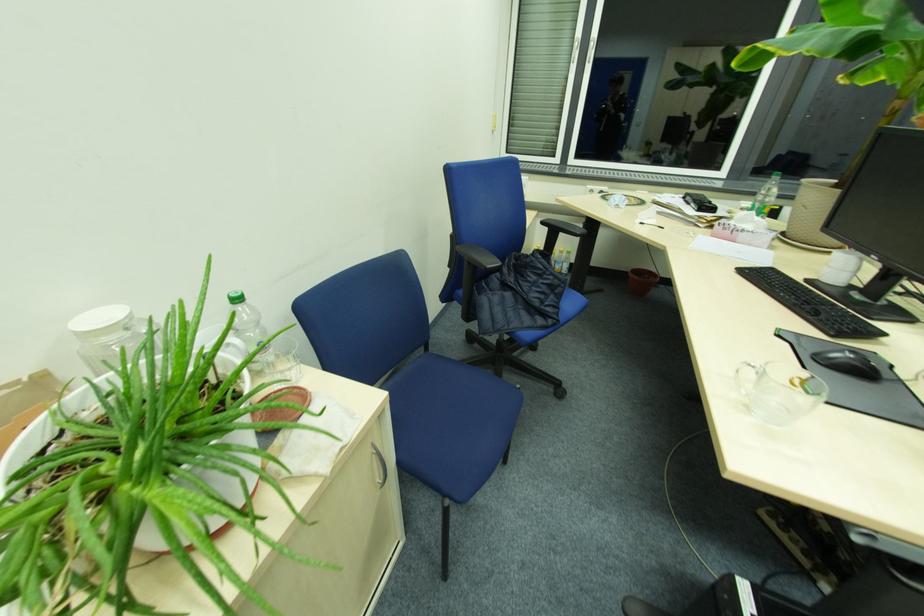
The image size is (924, 616). Find the location of `clear glass mug handle`. clear glass mug handle is located at coordinates (x=742, y=367).